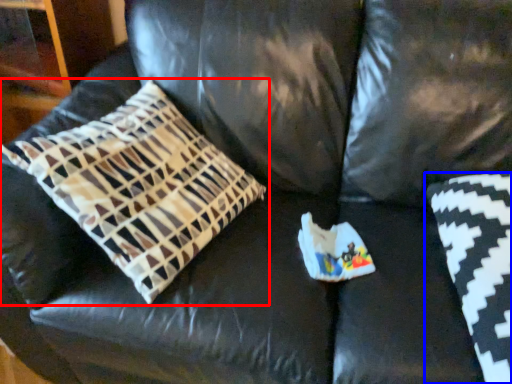
Question: Which object appears farthest to the camera in this image, pillow (highlighted by a red box) or pillow (highlighted by a blue box)?

Choices:
 (A) pillow
 (B) pillow

Answer: (B)